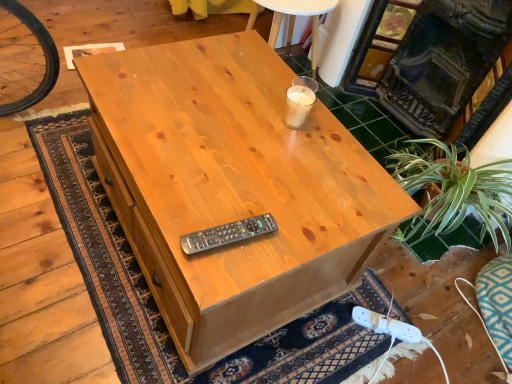
Describe the element at coordinates (232, 188) in the screenshot. I see `natural wood desk at center` at that location.

Locate an element on the screen. black plastic remote at center is located at coordinates (227, 233).

Looking at this image, what is the approximate width of white plastic plug at lower right?

white plastic plug at lower right is 10.29 inches wide.

Locate an element on the screen. dark gray stone fireplace at upper right is located at coordinates (435, 61).

Which of these two, dark gray stone fireplace at upper right or white plastic plug at lower right, is smaller?

white plastic plug at lower right.

Is dark gray stone fireplace at upper right oriented towards white plastic plug at lower right?

Yes.

Would you consider dark gray stone fireplace at upper right to be distant from white plastic plug at lower right?

dark gray stone fireplace at upper right is far away from white plastic plug at lower right.

Considering the sizes of objects dark gray stone fireplace at upper right and white plastic plug at lower right in the image provided, who is taller, dark gray stone fireplace at upper right or white plastic plug at lower right?

dark gray stone fireplace at upper right.

Which of these two, natural wood desk at center or dark gray stone fireplace at upper right, is bigger?

With larger size is natural wood desk at center.

From a real-world perspective, who is located higher, natural wood desk at center or dark gray stone fireplace at upper right?

In real-world perspective, dark gray stone fireplace at upper right is above.

Can you confirm if natural wood desk at center is wider than dark gray stone fireplace at upper right?

Correct, the width of natural wood desk at center exceeds that of dark gray stone fireplace at upper right.

At what (x,y) coordinates should I click in order to perform the action: click on fireplace lying behind the natural wood desk at center. Please return your answer as a coordinate pair (x, y). Looking at the image, I should click on (435, 61).

From the image's perspective, is natural wood desk at center located beneath white plastic plug at lower right?

Incorrect, from the image's perspective, natural wood desk at center is higher than white plastic plug at lower right.

Does natural wood desk at center turn towards white plastic plug at lower right?

Yes, natural wood desk at center is oriented towards white plastic plug at lower right.

Is natural wood desk at center surrounding white plastic plug at lower right?

No, white plastic plug at lower right is not surrounded by natural wood desk at center.

Locate an element on the screen. Image resolution: width=512 pixels, height=384 pixels. control above the white plastic plug at lower right (from the image's perspective) is located at coordinates (227, 233).

Does black plastic remote at center have a lesser height compared to white plastic plug at lower right?

No, black plastic remote at center is not shorter than white plastic plug at lower right.

From the image's perspective, does black plastic remote at center appear lower than white plastic plug at lower right?

No.

Is black plastic remote at center turned away from white plastic plug at lower right?

No, black plastic remote at center is not facing away from white plastic plug at lower right.

Is black plastic remote at center in front of or behind dark gray stone fireplace at upper right in the image?

In the image, black plastic remote at center appears in front of dark gray stone fireplace at upper right.

Considering the sizes of objects black plastic remote at center and dark gray stone fireplace at upper right in the image provided, who is shorter, black plastic remote at center or dark gray stone fireplace at upper right?

black plastic remote at center.

Based on the photo, looking at their sizes, would you say black plastic remote at center is wider or thinner than dark gray stone fireplace at upper right?

black plastic remote at center is thinner than dark gray stone fireplace at upper right.

How many degrees apart are the facing directions of white plastic plug at lower right and dark gray stone fireplace at upper right?

42.5 degrees.

Which of these two, white plastic plug at lower right or dark gray stone fireplace at upper right, stands taller?

dark gray stone fireplace at upper right.

Is white plastic plug at lower right facing towards dark gray stone fireplace at upper right?

No, white plastic plug at lower right is not facing towards dark gray stone fireplace at upper right.

From the picture: Is white plastic plug at lower right not near dark gray stone fireplace at upper right?

white plastic plug at lower right is positioned a significant distance from dark gray stone fireplace at upper right.

Considering the relative positions of white plastic plug at lower right and black plastic remote at center in the image provided, is white plastic plug at lower right to the left of black plastic remote at center from the viewer's perspective?

In fact, white plastic plug at lower right is to the right of black plastic remote at center.

Considering the relative sizes of white plastic plug at lower right and black plastic remote at center in the image provided, is white plastic plug at lower right shorter than black plastic remote at center?

Indeed, white plastic plug at lower right has a lesser height compared to black plastic remote at center.

Does white plastic plug at lower right have a larger size compared to black plastic remote at center?

Indeed, white plastic plug at lower right has a larger size compared to black plastic remote at center.

From the image's perspective, is white plastic plug at lower right located above black plastic remote at center?

Actually, white plastic plug at lower right appears below black plastic remote at center in the image.

In the image, there is a dark gray stone fireplace at upper right. Identify the location of plug below it (from the image's perspective). The height and width of the screenshot is (384, 512). (386, 325).

Find the location of a particular element. The width and height of the screenshot is (512, 384). desk in front of the dark gray stone fireplace at upper right is located at coordinates (232, 188).

Considering their positions, is dark gray stone fireplace at upper right positioned further to natural wood desk at center than white plastic plug at lower right?

dark gray stone fireplace at upper right.

When comparing their distances from dark gray stone fireplace at upper right, does natural wood desk at center or white plastic plug at lower right seem further?

white plastic plug at lower right is further to dark gray stone fireplace at upper right.

From the image, which object appears to be nearer to white plastic plug at lower right, natural wood desk at center or black plastic remote at center?

Based on the image, natural wood desk at center appears to be nearer to white plastic plug at lower right.

Which object lies further to the anchor point natural wood desk at center, black plastic remote at center or white plastic plug at lower right?

white plastic plug at lower right.

When comparing their distances from black plastic remote at center, does natural wood desk at center or white plastic plug at lower right seem closer?

The object closer to black plastic remote at center is natural wood desk at center.

Based on their spatial positions, is natural wood desk at center or dark gray stone fireplace at upper right closer to white plastic plug at lower right?

Based on the image, natural wood desk at center appears to be nearer to white plastic plug at lower right.

Looking at the image, which one is located further to white plastic plug at lower right, black plastic remote at center or dark gray stone fireplace at upper right?

Among the two, dark gray stone fireplace at upper right is located further to white plastic plug at lower right.

Based on the photo, estimate the real-world distances between objects in this image. Which object is closer to white plastic plug at lower right, dark gray stone fireplace at upper right or black plastic remote at center?

black plastic remote at center is positioned closer to the anchor white plastic plug at lower right.

Where is `control between natural wood desk at center and dark gray stone fireplace at upper right`? The image size is (512, 384). control between natural wood desk at center and dark gray stone fireplace at upper right is located at coordinates (227, 233).

The height and width of the screenshot is (384, 512). In order to click on desk between dark gray stone fireplace at upper right and white plastic plug at lower right in the up-down direction in this screenshot , I will do `click(232, 188)`.

Where is `control between natural wood desk at center and white plastic plug at lower right from left to right`? control between natural wood desk at center and white plastic plug at lower right from left to right is located at coordinates (227, 233).

The width and height of the screenshot is (512, 384). I want to click on control between dark gray stone fireplace at upper right and white plastic plug at lower right in the vertical direction, so click(x=227, y=233).